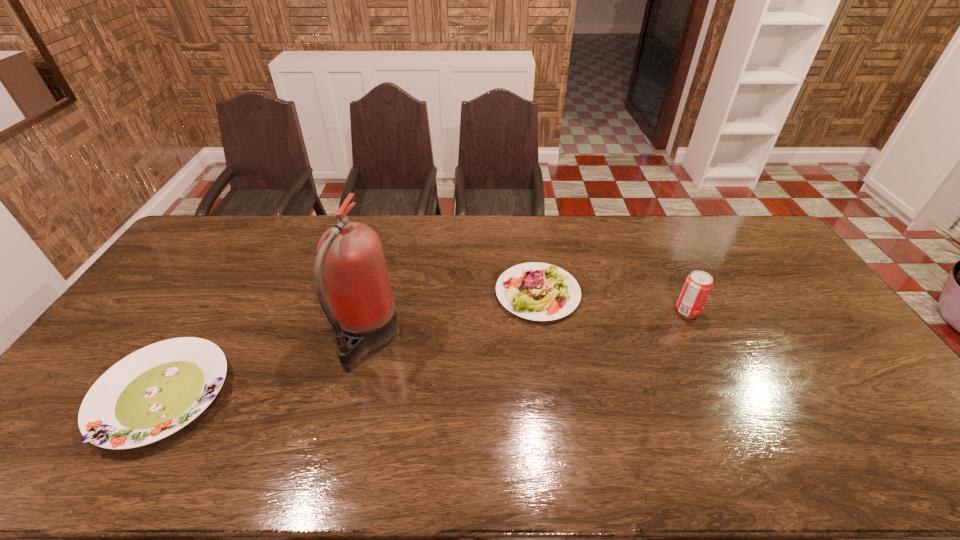
What are the coordinates of `vacant space that satisfies the following two spatial constraints: 1. on the front side of the second object from right to left; 2. at the nozzle of the second object from left to right` in the screenshot? It's located at (544, 340).

At what (x,y) coordinates should I click in order to perform the action: click on free space that satisfies the following two spatial constraints: 1. on the front side of the third object from left to right; 2. on the left side of the soda can. Please return your answer as a coordinate pair (x, y). This screenshot has width=960, height=540. Looking at the image, I should click on (540, 312).